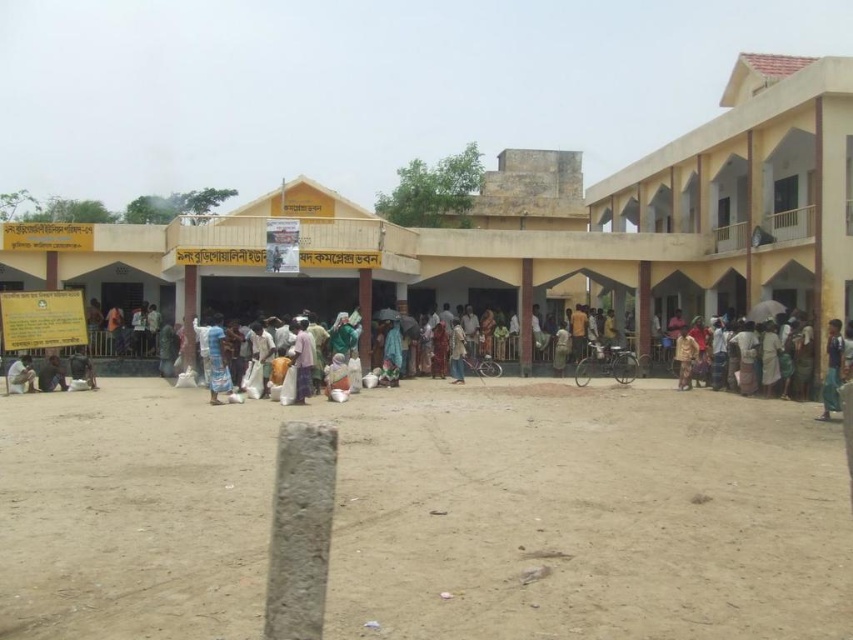
Question: Among these objects, which one is nearest to the camera?

Choices:
 (A) dark green fabric bag at lower left
 (B) brown sandy ground at center
 (C) white cotton cloth at center

Answer: (B)

Question: Does dark green fabric at lower left appear over white cotton cloth at center?

Choices:
 (A) yes
 (B) no

Answer: (A)

Question: Estimate the real-world distances between objects in this image. Which object is farther from the dark green fabric at lower left?

Choices:
 (A) dark green fabric bag at lower left
 (B) dark gray fabric bag at lower left
 (C) brown sandy ground at center

Answer: (C)

Question: In this image, where is brown sandy ground at center located relative to blue fabric pants at lower right?

Choices:
 (A) left
 (B) right

Answer: (A)

Question: Is blue fabric pants at lower right thinner than dark gray fabric bag at lower left?

Choices:
 (A) no
 (B) yes

Answer: (A)

Question: Which point is closer to the camera?

Choices:
 (A) dark gray fabric bag at lower left
 (B) white cotton cloth at center
 (C) blue fabric pants at lower right

Answer: (C)